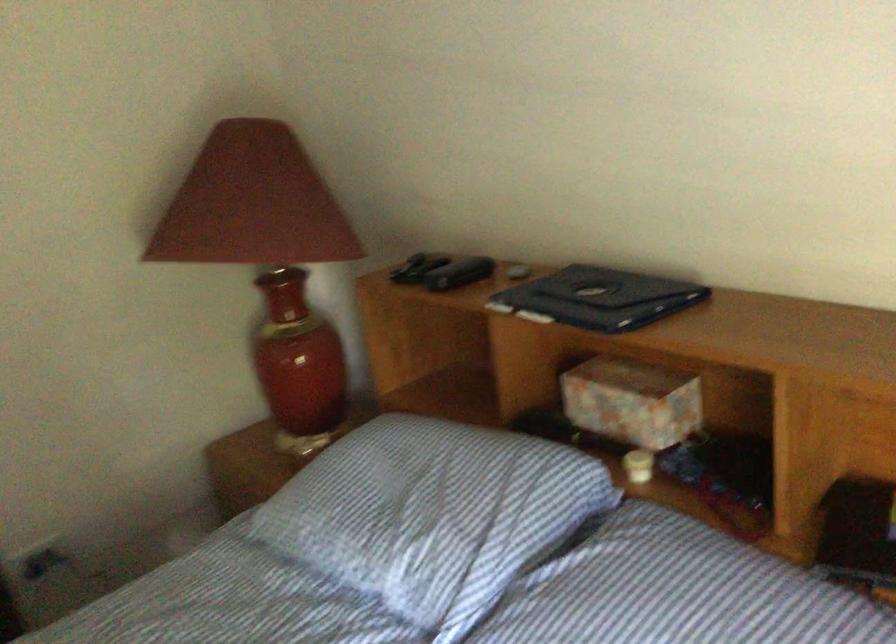
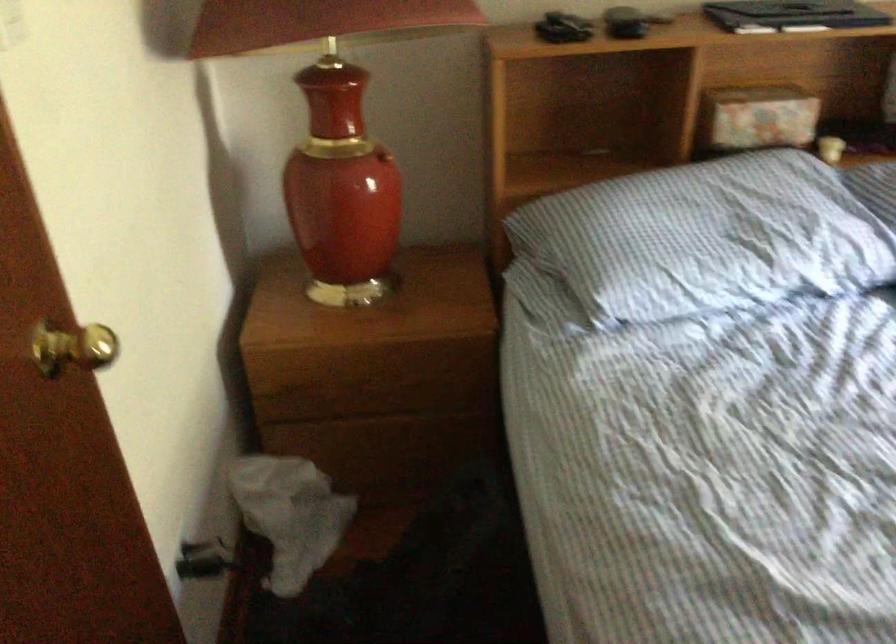
In the second image, find the point that corresponds to pixel 590 402 in the first image.

(757, 118)